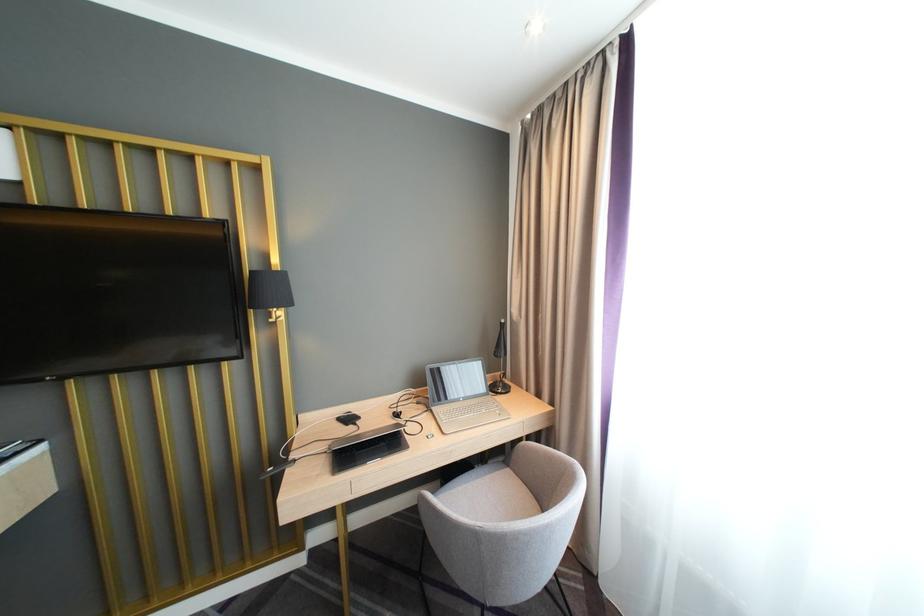
This screenshot has height=616, width=924. What do you see at coordinates (456, 379) in the screenshot?
I see `the silver laptop lid` at bounding box center [456, 379].